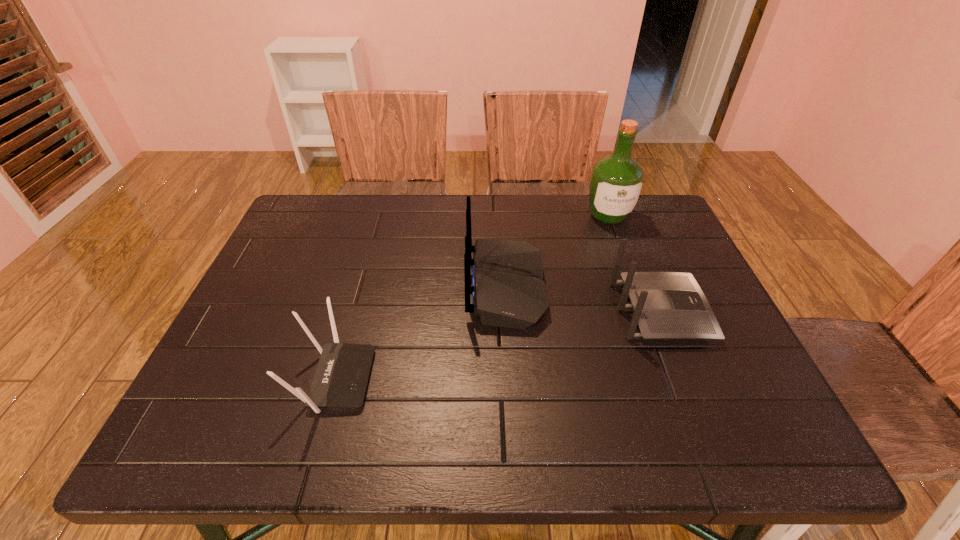
This screenshot has height=540, width=960. I want to click on free space between the leftmost object and the tallest router, so click(x=420, y=333).

You are a GUI agent. You are given a task and a screenshot of the screen. Output one action in this format:
    pyautogui.click(x=<x>, y=<y>)
    Task: Click on the object that is the second nearest to the farthest object
    The image size is (960, 540).
    Given the screenshot: What is the action you would take?
    pyautogui.click(x=666, y=305)

Point out which object is positioned as the third nearest to the farthest object. Please provide its 2D coordinates. Your answer should be formatted as a tuple, i.e. [(x, y)], where the tuple contains the x and y coordinates of a point satisfying the conditions above.

[(340, 381)]

Locate which router is the second closest to the tallest object. Please provide its 2D coordinates. Your answer should be formatted as a tuple, i.e. [(x, y)], where the tuple contains the x and y coordinates of a point satisfying the conditions above.

[(666, 305)]

The height and width of the screenshot is (540, 960). Find the location of `the closest router relative to the farthest object`. the closest router relative to the farthest object is located at coordinates click(x=509, y=290).

Where is `vacant space that satisfies the following two spatial constraints: 1. on the back of the second router from left to right; 2. on the front-facing side of the rightmost router`? vacant space that satisfies the following two spatial constraints: 1. on the back of the second router from left to right; 2. on the front-facing side of the rightmost router is located at coordinates 508,311.

Find the location of a particular element. The width and height of the screenshot is (960, 540). free location that satisfies the following two spatial constraints: 1. on the front-facing side of the tallest object; 2. on the front-facing side of the rightmost router is located at coordinates (643, 311).

The image size is (960, 540). I want to click on free space that satisfies the following two spatial constraints: 1. on the front-facing side of the farthest object; 2. on the front-facing side of the leftmost object, so click(668, 379).

At what (x,y) coordinates should I click in order to perform the action: click on vacant region that satisfies the following two spatial constraints: 1. on the front-facing side of the rightmost router; 2. on the back of the second object from left to right. Please return your answer as a coordinate pair (x, y). This screenshot has height=540, width=960. Looking at the image, I should click on (651, 287).

What are the coordinates of `vacant space that satisfies the following two spatial constraints: 1. on the front-facing side of the liquor; 2. on the front-facing side of the rightmost router` in the screenshot? It's located at (643, 311).